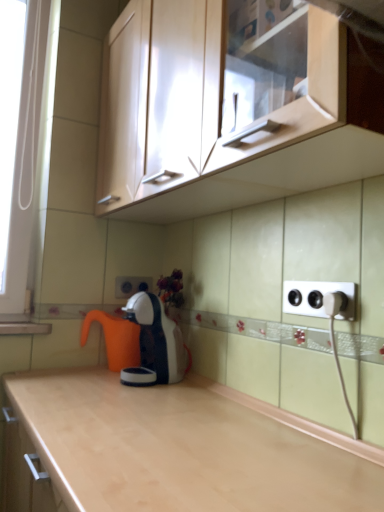
Question: From a real-world perspective, does matte wood cabinet at upper center sit lower than orange plastic coffee pot at center?

Choices:
 (A) no
 (B) yes

Answer: (A)

Question: From a real-world perspective, is matte wood cabinet at upper center on top of orange plastic coffee pot at center?

Choices:
 (A) no
 (B) yes

Answer: (B)

Question: Is matte wood cabinet at upper center not inside orange plastic coffee pot at center?

Choices:
 (A) no
 (B) yes

Answer: (B)

Question: From the image's perspective, is matte wood cabinet at upper center on orange plastic coffee pot at center?

Choices:
 (A) yes
 (B) no

Answer: (A)

Question: Does matte wood cabinet at upper center have a greater height compared to orange plastic coffee pot at center?

Choices:
 (A) no
 (B) yes

Answer: (B)

Question: Is point (307, 291) positioned closer to the camera than point (122, 346)?

Choices:
 (A) farther
 (B) closer

Answer: (B)

Question: Considering the relative positions of white plastic electrical outlet at right, arranged as the 2th electric outlet when viewed from the back, and orange plastic coffee pot at center in the image provided, is white plastic electrical outlet at right, arranged as the 2th electric outlet when viewed from the back, to the left or to the right of orange plastic coffee pot at center?

Choices:
 (A) left
 (B) right

Answer: (B)

Question: From the image's perspective, is white plastic electrical outlet at right, the 1th electric outlet in the front-to-back sequence, positioned above or below orange plastic coffee pot at center?

Choices:
 (A) above
 (B) below

Answer: (A)

Question: From a real-world perspective, relative to orange plastic coffee pot at center, is white plastic electrical outlet at right, arranged as the 2th electric outlet when viewed from the back, vertically above or below?

Choices:
 (A) below
 (B) above

Answer: (B)

Question: Which is correct: white plastic electric outlet at center, which ranks as the 2th electric outlet in right-to-left order, is inside orange plastic coffee pot at center, or outside of it?

Choices:
 (A) inside
 (B) outside

Answer: (B)

Question: From the image's perspective, is white plastic electric outlet at center, which appears as the second electric outlet when viewed from the front, located above or below orange plastic coffee pot at center?

Choices:
 (A) above
 (B) below

Answer: (A)

Question: In terms of height, does white plastic electric outlet at center, which appears as the second electric outlet when viewed from the front, look taller or shorter compared to orange plastic coffee pot at center?

Choices:
 (A) tall
 (B) short

Answer: (B)

Question: Does point coord(134,292) appear closer or farther from the camera than point coord(134,332)?

Choices:
 (A) closer
 (B) farther

Answer: (B)

Question: Is white plastic plug at right inside the boundaries of matte wood cabinet at upper center, or outside?

Choices:
 (A) inside
 (B) outside

Answer: (B)

Question: Is point (336, 309) positioned closer to the camera than point (307, 143)?

Choices:
 (A) closer
 (B) farther

Answer: (B)